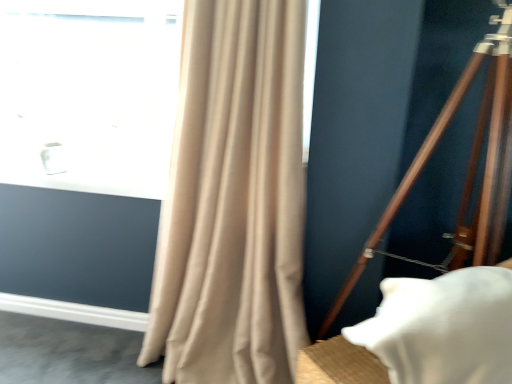
Question: Is transparent glass window at upper left in front of wooden tripod at right?

Choices:
 (A) no
 (B) yes

Answer: (A)

Question: Is transparent glass window at upper left taller than wooden tripod at right?

Choices:
 (A) yes
 (B) no

Answer: (B)

Question: Is transparent glass window at upper left shorter than wooden tripod at right?

Choices:
 (A) yes
 (B) no

Answer: (A)

Question: Does transparent glass window at upper left have a lesser width compared to wooden tripod at right?

Choices:
 (A) yes
 (B) no

Answer: (A)

Question: Does transparent glass window at upper left turn towards wooden tripod at right?

Choices:
 (A) yes
 (B) no

Answer: (B)

Question: Is transparent glass window at upper left bigger than wooden tripod at right?

Choices:
 (A) yes
 (B) no

Answer: (B)

Question: Considering the relative sizes of beige fabric curtain at left and transparent glass window at upper left in the image provided, is beige fabric curtain at left wider than transparent glass window at upper left?

Choices:
 (A) yes
 (B) no

Answer: (A)

Question: Is beige fabric curtain at left turned away from transparent glass window at upper left?

Choices:
 (A) yes
 (B) no

Answer: (B)

Question: Does beige fabric curtain at left contain transparent glass window at upper left?

Choices:
 (A) no
 (B) yes

Answer: (A)

Question: Considering the relative sizes of beige fabric curtain at left and transparent glass window at upper left in the image provided, is beige fabric curtain at left taller than transparent glass window at upper left?

Choices:
 (A) no
 (B) yes

Answer: (B)

Question: Is the surface of beige fabric curtain at left in direct contact with transparent glass window at upper left?

Choices:
 (A) yes
 (B) no

Answer: (B)

Question: Is beige fabric curtain at left positioned behind transparent glass window at upper left?

Choices:
 (A) yes
 (B) no

Answer: (B)

Question: Does wooden tripod at right have a lesser width compared to white matte pillow at lower right?

Choices:
 (A) no
 (B) yes

Answer: (A)